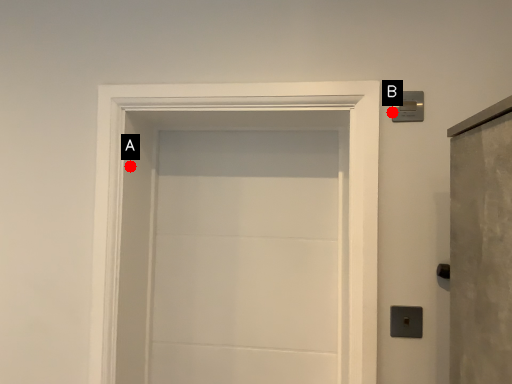
Question: Two points are circled on the image, labeled by A and B beside each circle. Which point appears farthest from the camera in this image?

Choices:
 (A) A is further
 (B) B is further

Answer: (A)